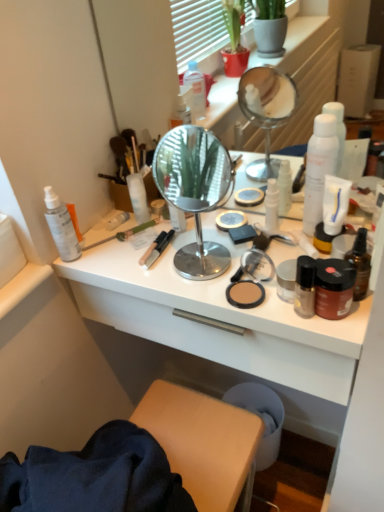
I want to click on vacant area that lies between white matte spray can at left, the seventh toiletry in the right-to-left sequence, and matte gold jar at center right, which ranks as the eighth toiletry in left-to-right order, so click(x=192, y=248).